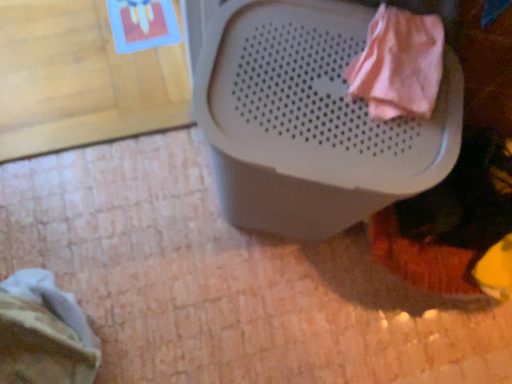
This screenshot has height=384, width=512. I want to click on unoccupied space behind striped fabric at lower left, positioned as the 2th clothing in top-to-bottom order, so click(x=99, y=269).